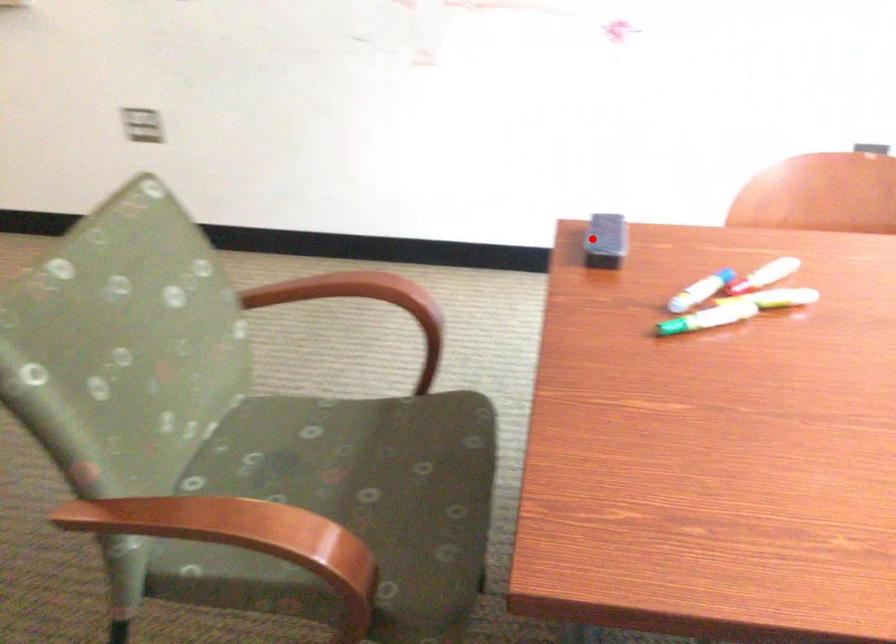
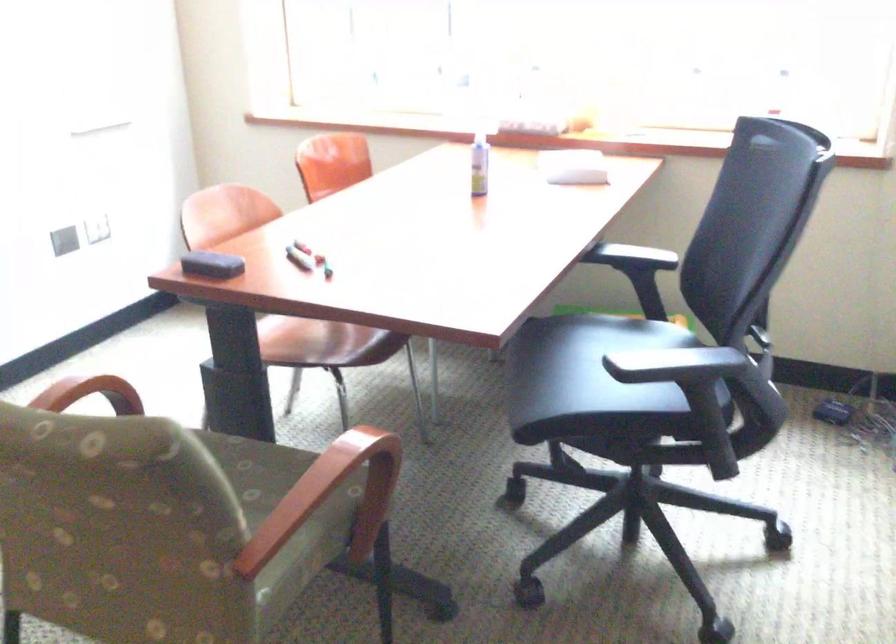
The point at the highlighted location is marked in the first image. Where is the corresponding point in the second image?

(211, 265)